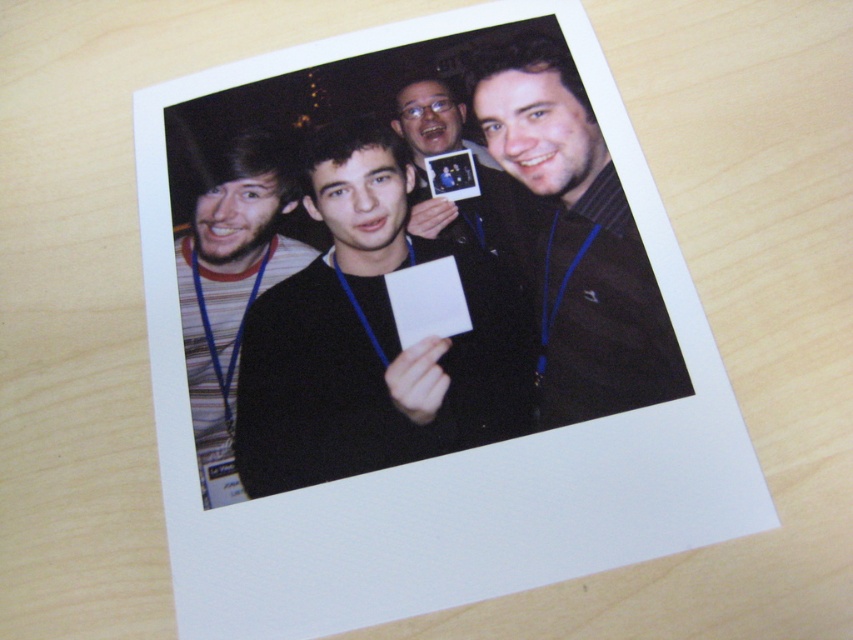
You are holding a camera and want to take a photo of the scene. The camera is currently positioned at a point that is 19.50 inches away from point (408, 433). To ensure the subject is in focus, you need to adjust the focus distance. What should the focus distance be set to in inches?

The focus distance should be set to 19.50 inches because the camera is positioned at a point that is 19.50 inches away from point (408, 433), which is the subject.

In the scene shown: You are looking at the Polaroid photograph and notice two people wearing different tops. The black matte sweater at center and the striped fabric shirt at left. Which one is positioned more to the left side of the image?

The striped fabric shirt at left is positioned more to the left side of the image.